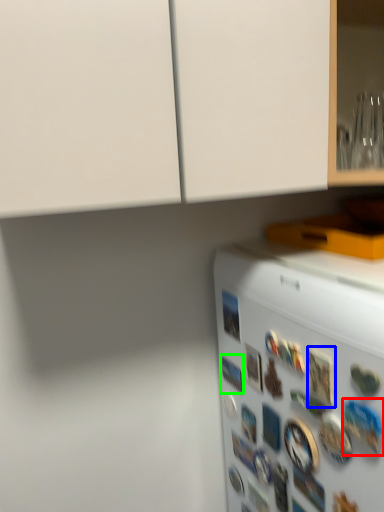
Question: Which is nearer to the button (highlighted by a red box)? button (highlighted by a blue box) or button (highlighted by a green box).

Choices:
 (A) button
 (B) button

Answer: (A)